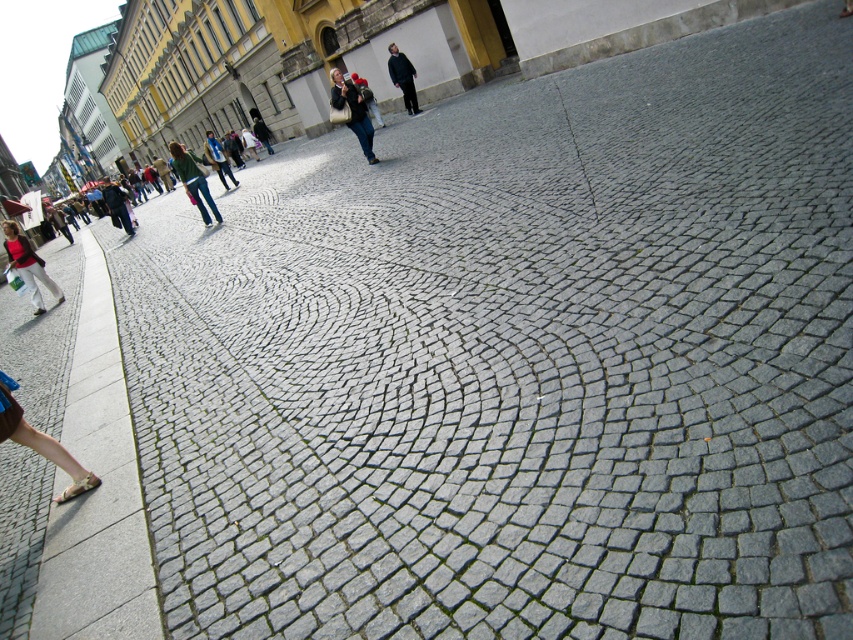
Does point (3, 241) come farther from viewer compared to point (85, 492)?

Yes, it is behind point (85, 492).

Between point (28, 260) and point (97, 484), which one is positioned in front?

Point (97, 484)

Locate an element on the screen. The height and width of the screenshot is (640, 853). matte white pants at left is located at coordinates (27, 264).

Is matte black jacket at center further to the viewer compared to light brown leather sandal at lower left?

Yes, it is behind light brown leather sandal at lower left.

Between matte black jacket at center and light brown leather sandal at lower left, which one appears on the right side from the viewer's perspective?

From the viewer's perspective, matte black jacket at center appears more on the right side.

What are the coordinates of `matte black jacket at center` in the screenshot? It's located at (352, 112).

Which is behind, point (334, 96) or point (178, 170)?

Point (178, 170)

Does matte black jacket at center lie in front of green fabric jacket at center?

That is True.

Does point (364, 154) lie behind point (178, 160)?

No, it is not.

This screenshot has width=853, height=640. I want to click on matte black jacket at center, so click(x=352, y=112).